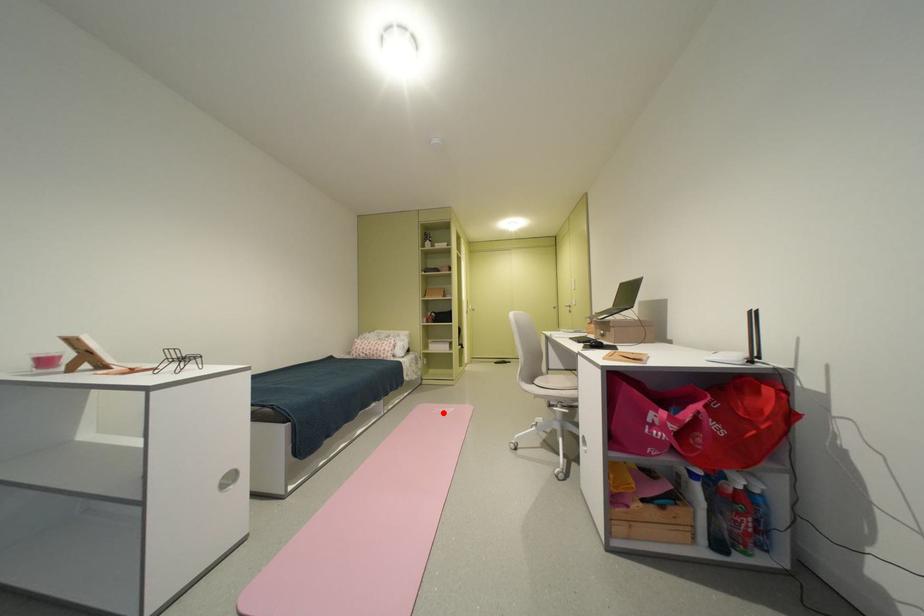
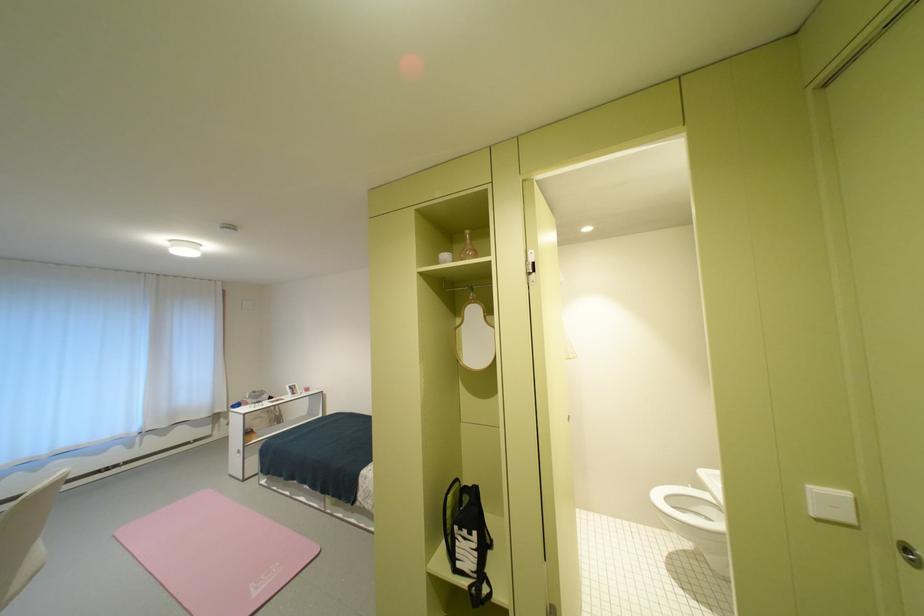
The point at the highlighted location is marked in the first image. Where is the corresponding point in the second image?

(286, 565)